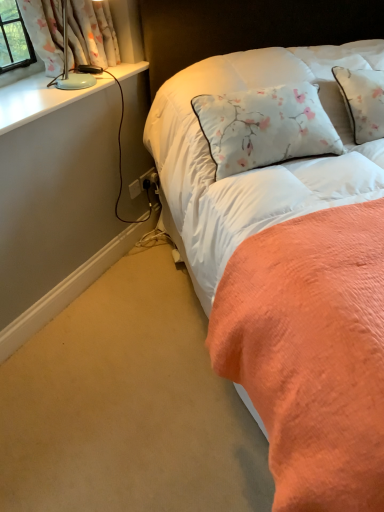
Question: From the image's perspective, would you say white plastic power outlet at lower center is shown under floral fabric pillow at upper right?

Choices:
 (A) no
 (B) yes

Answer: (B)

Question: From the image's perspective, does white plastic power outlet at lower center appear higher than floral fabric pillow at upper right?

Choices:
 (A) yes
 (B) no

Answer: (B)

Question: Is white plastic power outlet at lower center oriented towards floral fabric pillow at upper right?

Choices:
 (A) no
 (B) yes

Answer: (B)

Question: Is floral fabric pillow at upper right surrounded by white plastic power outlet at lower center?

Choices:
 (A) yes
 (B) no

Answer: (B)

Question: Considering the relative sizes of white plastic power outlet at lower center and floral fabric pillow at upper right in the image provided, is white plastic power outlet at lower center bigger than floral fabric pillow at upper right?

Choices:
 (A) yes
 (B) no

Answer: (B)

Question: Does white plastic power outlet at lower center have a greater height compared to floral fabric pillow at upper right?

Choices:
 (A) no
 (B) yes

Answer: (A)

Question: From the image's perspective, is white plastic power outlet at lower center located beneath white floral fabric at upper left?

Choices:
 (A) no
 (B) yes

Answer: (B)

Question: Is white plastic power outlet at lower center positioned behind white floral fabric at upper left?

Choices:
 (A) no
 (B) yes

Answer: (B)

Question: From a real-world perspective, is white plastic power outlet at lower center physically above white floral fabric at upper left?

Choices:
 (A) no
 (B) yes

Answer: (A)

Question: Is white plastic power outlet at lower center to the left of white floral fabric at upper left from the viewer's perspective?

Choices:
 (A) yes
 (B) no

Answer: (B)

Question: Is white plastic power outlet at lower center aimed at white floral fabric at upper left?

Choices:
 (A) yes
 (B) no

Answer: (B)

Question: Is white plastic power outlet at lower center bigger than white floral fabric at upper left?

Choices:
 (A) no
 (B) yes

Answer: (A)

Question: Would you say white plastic electrical outlet at lower center is part of floral fabric pillow at upper right's contents?

Choices:
 (A) yes
 (B) no

Answer: (B)